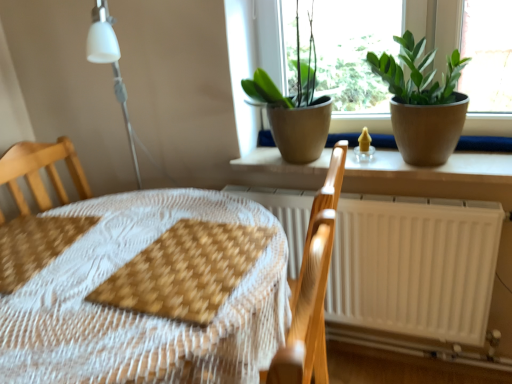
Locate an element on the screen. The image size is (512, 384). vacant region under brown woven placemat at lower left, placed as the first sheet when sorted from left to right (from a real-world perspective) is located at coordinates (35, 245).